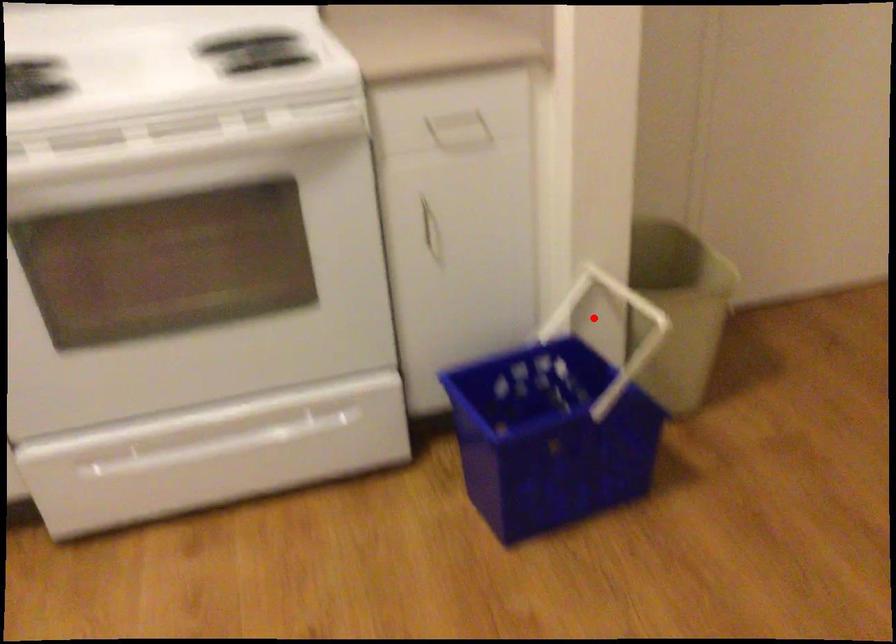
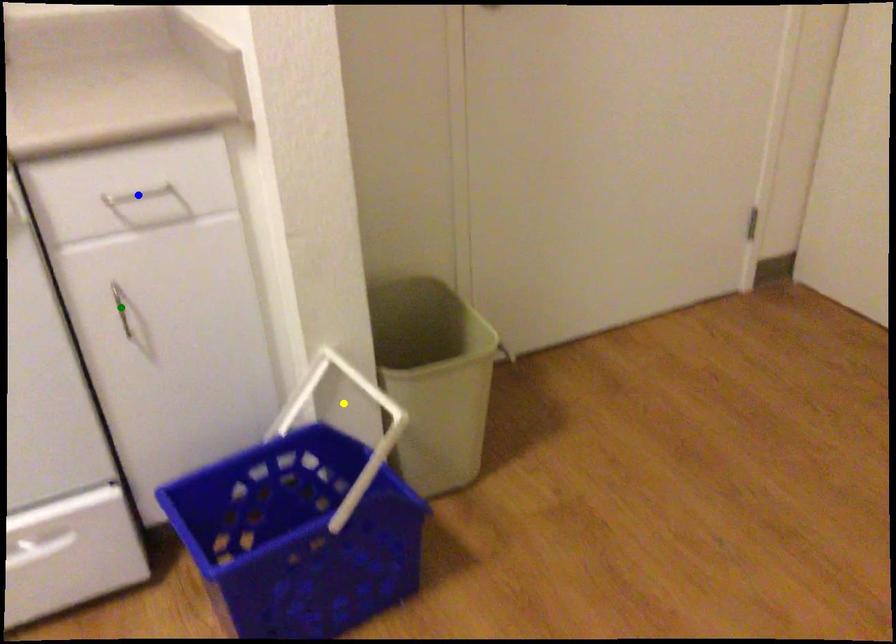
Question: I am providing you with two images of the same scene from different viewpoints. A red point is marked on the first image. You are given multiple points on the second image. In image 2, which mark is for the same physical point as the one in image 1?

Choices:
 (A) green point
 (B) blue point
 (C) yellow point

Answer: (C)